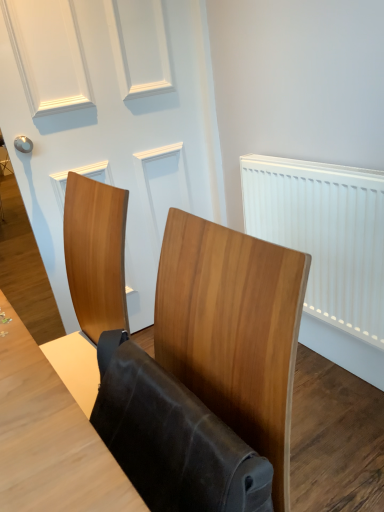
What do you see at coordinates (324, 234) in the screenshot?
I see `white plastic radiator at right` at bounding box center [324, 234].

Describe the element at coordinates (172, 438) in the screenshot. I see `leather-like brown folding chair at center` at that location.

The image size is (384, 512). What do you see at coordinates (208, 369) in the screenshot? I see `wooden chair at center` at bounding box center [208, 369].

You are a GUI agent. You are given a task and a screenshot of the screen. Output one action in this format:
    pyautogui.click(x=<x>, y=<y>)
    Task: Click on the white plastic radiator at right
    
    Given the screenshot: What is the action you would take?
    pyautogui.click(x=324, y=234)

Does point (152, 467) appear closer or farther from the camera than point (165, 280)?

Point (152, 467) is positioned closer to the camera compared to point (165, 280).

Is leather-like brown folding chair at center oriented away from wooden chair at center?

Yes, leather-like brown folding chair at center's orientation is away from wooden chair at center.

Considering the sizes of leather-like brown folding chair at center and wooden chair at center in the image, is leather-like brown folding chair at center wider or thinner than wooden chair at center?

In the image, leather-like brown folding chair at center appears to be more narrow than wooden chair at center.

Does leather-like brown folding chair at center contain wooden chair at center?

No.

Can you confirm if white plastic radiator at right is taller than white matte door at upper center?

Incorrect, the height of white plastic radiator at right is not larger of that of white matte door at upper center.

Locate an element on the screen. The image size is (384, 512). door above the white plastic radiator at right (from the image's perspective) is located at coordinates (112, 122).

Would you say white matte door at upper center is part of white plastic radiator at right's contents?

No, white matte door at upper center is not inside white plastic radiator at right.

In the scene shown: Considering the relative sizes of white plastic radiator at right and wooden chair at center in the image provided, is white plastic radiator at right smaller than wooden chair at center?

Yes.

Which object is positioned more to the left, white plastic radiator at right or wooden chair at center?

wooden chair at center is more to the left.

Locate an element on the screen. radiator that appears above the wooden chair at center (from the image's perspective) is located at coordinates (324, 234).

How many degrees apart are the facing directions of white matte door at upper center and wooden chair at center?

There is a 93.6-degree angle between the facing directions of white matte door at upper center and wooden chair at center.

Is white matte door at upper center placed right next to wooden chair at center?

There is a gap between white matte door at upper center and wooden chair at center.

Does white matte door at upper center have a smaller size compared to wooden chair at center?

No.

From a real-world perspective, is white matte door at upper center physically located above or below wooden chair at center?

From a real-world perspective, white matte door at upper center is physically above wooden chair at center.

Between white plastic radiator at right and leather-like brown folding chair at center, which one appears on the left side from the viewer's perspective?

Positioned to the left is leather-like brown folding chair at center.

From the picture: Is white plastic radiator at right not close to leather-like brown folding chair at center?

No.

Is white plastic radiator at right not within leather-like brown folding chair at center?

Yes, white plastic radiator at right is outside of leather-like brown folding chair at center.

Is white plastic radiator at right wider or thinner than leather-like brown folding chair at center?

In the image, white plastic radiator at right appears to be more narrow than leather-like brown folding chair at center.

From a real-world perspective, which object rests below the other?

wooden chair at center, from a real-world perspective.

Locate an element on the screen. This screenshot has height=512, width=384. furniture in front of the leather-like brown folding chair at center is located at coordinates (208, 369).

Which object is wider, wooden chair at center or leather-like brown folding chair at center?

With larger width is wooden chair at center.

From the picture: Between wooden chair at center and leather-like brown folding chair at center, which one has more height?

With more height is wooden chair at center.

Relative to white plastic radiator at right, is wooden chair at center in front or behind?

wooden chair at center is positioned closer to the viewer than white plastic radiator at right.

Which point is more forward, (183, 452) or (349, 262)?

The point (183, 452) is closer.

Who is smaller, wooden chair at center or white plastic radiator at right?

With smaller size is white plastic radiator at right.

The height and width of the screenshot is (512, 384). Identify the location of folding chair located above the wooden chair at center (from a real-world perspective). (172, 438).

The width and height of the screenshot is (384, 512). Identify the location of door to the left of white plastic radiator at right. (112, 122).

From the image, which object appears to be nearer to white plastic radiator at right, wooden chair at center or white matte door at upper center?

white matte door at upper center.

When comparing their distances from wooden chair at center, does leather-like brown folding chair at center or white plastic radiator at right seem further?

Based on the image, white plastic radiator at right appears to be further to wooden chair at center.

Based on their spatial positions, is white matte door at upper center or leather-like brown folding chair at center closer to white plastic radiator at right?

The object closer to white plastic radiator at right is white matte door at upper center.

Looking at the image, which one is located closer to white matte door at upper center, wooden chair at center or leather-like brown folding chair at center?

wooden chair at center lies closer to white matte door at upper center than the other object.

Based on their spatial positions, is white plastic radiator at right or white matte door at upper center further from leather-like brown folding chair at center?

white matte door at upper center lies further to leather-like brown folding chair at center than the other object.

Considering their positions, is white matte door at upper center positioned closer to white plastic radiator at right than wooden chair at center?

white matte door at upper center.

Considering their positions, is leather-like brown folding chair at center positioned further to white plastic radiator at right than white matte door at upper center?

leather-like brown folding chair at center lies further to white plastic radiator at right than the other object.

Estimate the real-world distances between objects in this image. Which object is further from white plastic radiator at right, wooden chair at center or leather-like brown folding chair at center?

Based on the image, leather-like brown folding chair at center appears to be further to white plastic radiator at right.

Identify the location of folding chair between wooden chair at center and white plastic radiator at right in the front-back direction. (172, 438).

Identify the location of radiator between wooden chair at center and white matte door at upper center along the z-axis. (324, 234).

Where is `radiator between leather-like brown folding chair at center and white matte door at upper center along the z-axis`? This screenshot has height=512, width=384. radiator between leather-like brown folding chair at center and white matte door at upper center along the z-axis is located at coordinates (324, 234).

The image size is (384, 512). Identify the location of folding chair located between wooden chair at center and white matte door at upper center in the depth direction. (172, 438).